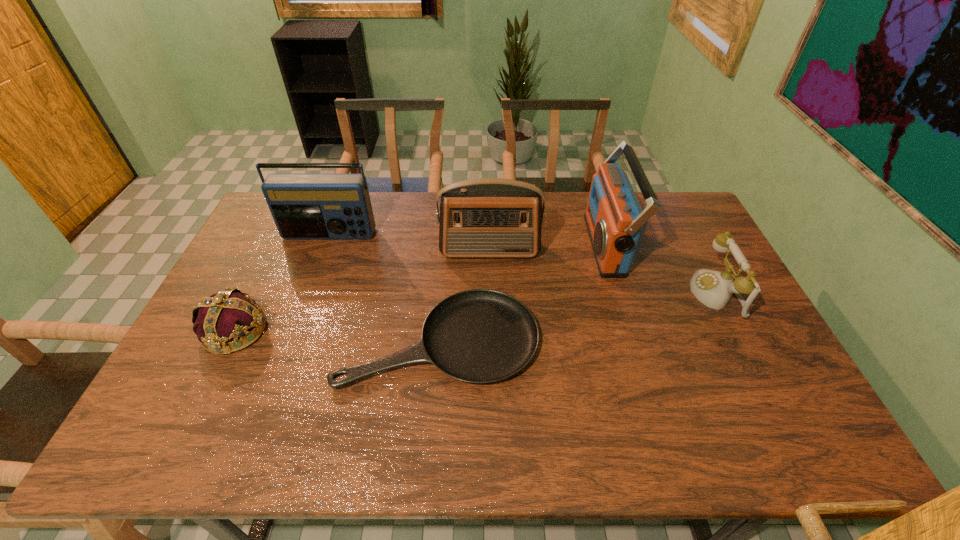
Where is `the fourth closest object relative to the shortest object`? the fourth closest object relative to the shortest object is located at coordinates (304, 206).

Select which object is the fifth closest to the shortest object. Please provide its 2D coordinates. Your answer should be formatted as a tuple, i.e. [(x, y)], where the tuple contains the x and y coordinates of a point satisfying the conditions above.

[(714, 289)]

Image resolution: width=960 pixels, height=540 pixels. In order to click on radio receiver that stands as the closest to the crown in this screenshot , I will do click(304, 206).

Identify which radio receiver is the second nearest to the telephone. Please provide its 2D coordinates. Your answer should be formatted as a tuple, i.e. [(x, y)], where the tuple contains the x and y coordinates of a point satisfying the conditions above.

[(488, 217)]

Identify the location of free space that satisfies the following two spatial constraints: 1. on the dial of the rightmost object; 2. on the front side of the shortest object. (739, 340).

Find the location of a particular element. Image resolution: width=960 pixels, height=540 pixels. vacant space that satisfies the following two spatial constraints: 1. on the front-facing side of the fifth object from left to right; 2. on the front-facing side of the second radio receiver from right to left is located at coordinates (608, 251).

Locate an element on the screen. Image resolution: width=960 pixels, height=540 pixels. vacant position in the image that satisfies the following two spatial constraints: 1. on the front-facing side of the second object from right to left; 2. on the front-facing side of the second radio receiver from left to right is located at coordinates (608, 251).